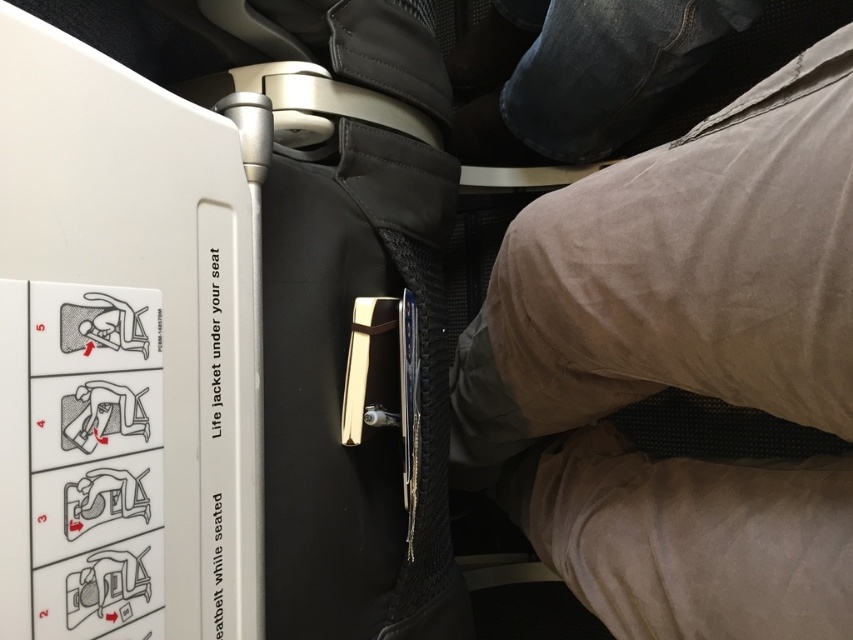
Between black mesh bag at center and khaki cotton pants at lower right, which one appears on the left side from the viewer's perspective?

Positioned to the left is black mesh bag at center.

Is point (163, 120) more distant than point (585, 596)?

No.

Image resolution: width=853 pixels, height=640 pixels. Find the location of `black mesh bag at center`. black mesh bag at center is located at coordinates (171, 365).